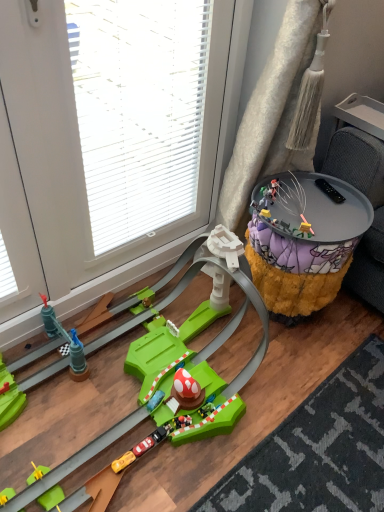
Find the location of `free area behind metallic gold figure at center-right, arranged as the 1th toy when viewed from the right`. free area behind metallic gold figure at center-right, arranged as the 1th toy when viewed from the right is located at coordinates (304, 207).